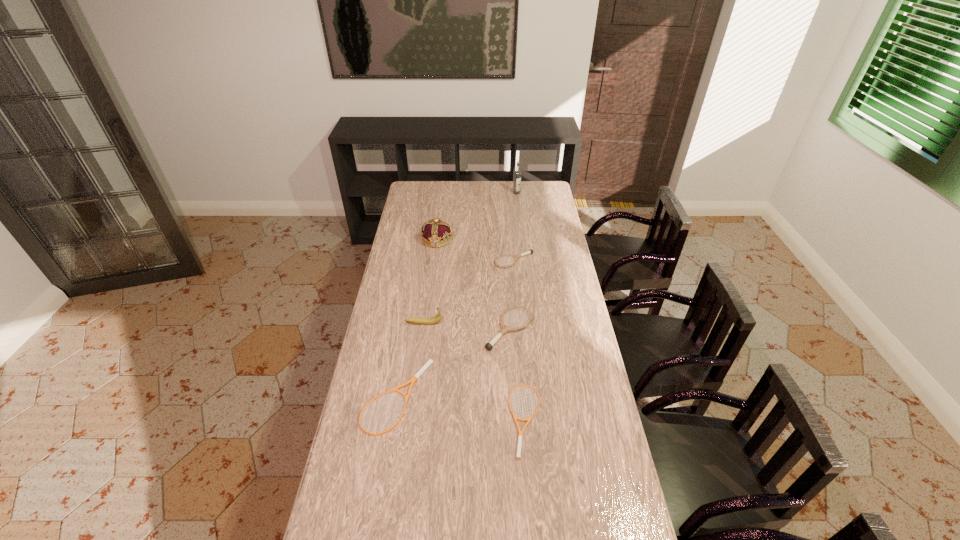
The width and height of the screenshot is (960, 540). Identify the location of tennis racket that is the closest to the fifth tallest object. (505, 328).

Locate an element on the screen. beige tennis racket that is the closest one to the purple crown is located at coordinates pyautogui.click(x=423, y=369).

The image size is (960, 540). Find the location of `vacant area in the image that satisfies the following two spatial constraints: 1. at the stem of the fifth shortest object; 2. on the right side of the tallest tennis racket`. vacant area in the image that satisfies the following two spatial constraints: 1. at the stem of the fifth shortest object; 2. on the right side of the tallest tennis racket is located at coordinates (423, 329).

Where is `free region that satisfies the following two spatial constraints: 1. on the back side of the second shortest object; 2. on the right side of the tallest tennis racket`? free region that satisfies the following two spatial constraints: 1. on the back side of the second shortest object; 2. on the right side of the tallest tennis racket is located at coordinates (406, 329).

You are a GUI agent. You are given a task and a screenshot of the screen. Output one action in this format:
    pyautogui.click(x=<x>, y=<y>)
    Task: Click on the vacant region that satisfies the following two spatial constraints: 1. at the stem of the yellow banana; 2. on the back side of the shortest object
    Image resolution: width=960 pixels, height=540 pixels.
    Given the screenshot: What is the action you would take?
    (x=411, y=420)